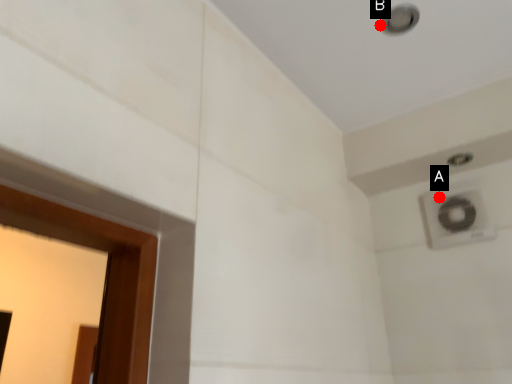
Question: Two points are circled on the image, labeled by A and B beside each circle. Which point is closer to the camera?

Choices:
 (A) A is closer
 (B) B is closer

Answer: (B)